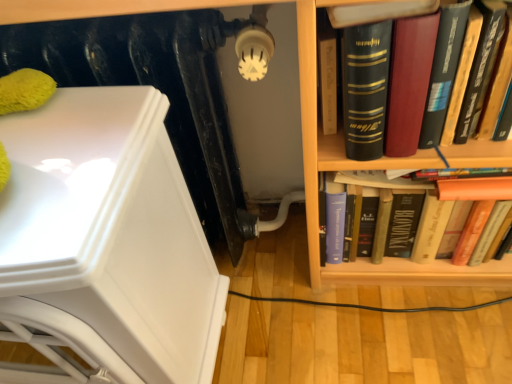
Question: Considering the relative sizes of hardcover book at right and wooden bookshelf at right in the image provided, is hardcover book at right bigger than wooden bookshelf at right?

Choices:
 (A) yes
 (B) no

Answer: (B)

Question: From the image's perspective, does hardcover book at right appear lower than wooden bookshelf at right?

Choices:
 (A) yes
 (B) no

Answer: (B)

Question: Considering the relative sizes of hardcover book at right and wooden bookshelf at right in the image provided, is hardcover book at right taller than wooden bookshelf at right?

Choices:
 (A) yes
 (B) no

Answer: (B)

Question: Is hardcover book at right shorter than wooden bookshelf at right?

Choices:
 (A) yes
 (B) no

Answer: (A)

Question: From a real-world perspective, is hardcover book at right over wooden bookshelf at right?

Choices:
 (A) yes
 (B) no

Answer: (A)

Question: Considering the positions of point (202, 31) and point (117, 218), is point (202, 31) closer or farther from the camera than point (117, 218)?

Choices:
 (A) farther
 (B) closer

Answer: (A)

Question: In the image, is black matte radiator at upper left on the left side or the right side of white glossy armchair at left?

Choices:
 (A) left
 (B) right

Answer: (B)

Question: Do you think black matte radiator at upper left is within white glossy armchair at left, or outside of it?

Choices:
 (A) inside
 (B) outside

Answer: (B)

Question: Is black matte radiator at upper left bigger or smaller than white glossy armchair at left?

Choices:
 (A) small
 (B) big

Answer: (A)

Question: Is black matte radiator at upper left in front of or behind hardcover book at right in the image?

Choices:
 (A) behind
 (B) front

Answer: (A)

Question: In terms of height, does black matte radiator at upper left look taller or shorter compared to hardcover book at right?

Choices:
 (A) tall
 (B) short

Answer: (A)

Question: Considering the positions of black matte radiator at upper left and hardcover book at right in the image, is black matte radiator at upper left bigger or smaller than hardcover book at right?

Choices:
 (A) big
 (B) small

Answer: (A)

Question: From a real-world perspective, is black matte radiator at upper left above or below hardcover book at right?

Choices:
 (A) above
 (B) below

Answer: (B)

Question: From a real-world perspective, is wooden bookshelf at right above or below hardcover book at right?

Choices:
 (A) above
 (B) below

Answer: (B)

Question: Considering their positions, is wooden bookshelf at right located in front of or behind hardcover book at right?

Choices:
 (A) behind
 (B) front

Answer: (B)